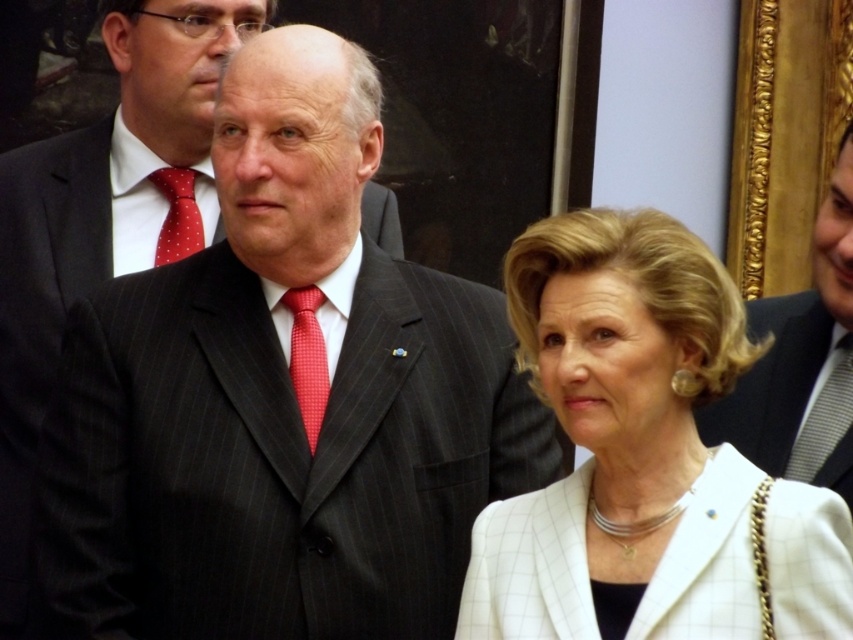
Looking at this image, you are a photographer at a formal event and need to adjust the lighting to ensure both the white textured blazer at center and the white checkered blazer at center are visible. Which blazer should you focus the light on first based on their positions?

The white textured blazer at center is above the white checkered blazer at center, so you should focus the light on the white textured blazer at center first as it is higher up and might cast shadows on the lower one.

You are a photographer at a formal event and need to adjust your camera focus. You see the white textured blazer at center and the red dotted tie at center. Which one is closer to you?

Result: The white textured blazer at center is closer to you since it is in front of the red dotted tie at center.

You are attending a formal event and notice two items of clothing in the scene. The white textured blazer at center and the red dotted tie at center. Which clothing item is located to the right of the other?

The white textured blazer at center is positioned on the right side of red dotted tie at center.